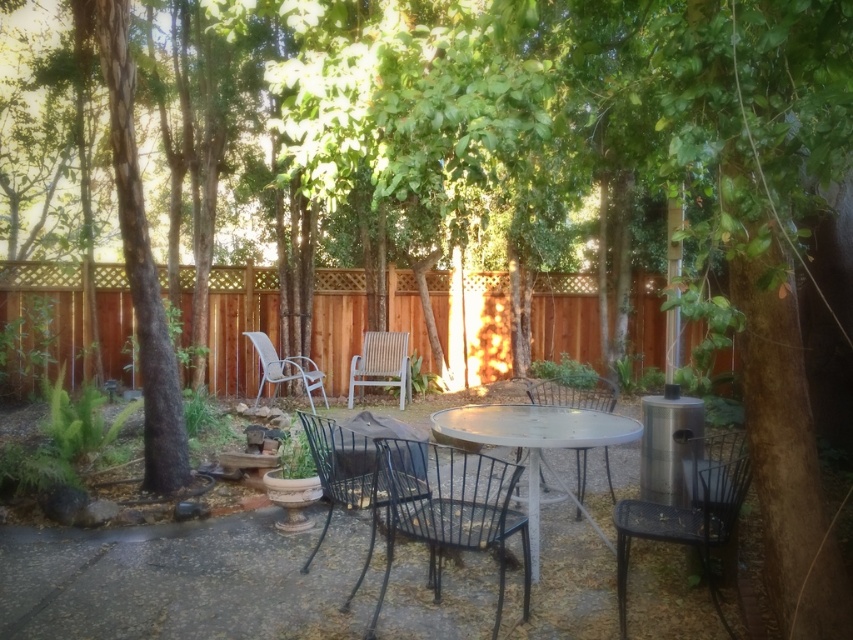
Between point (300, 413) and point (358, 371), which one is positioned in front?

Point (300, 413) is more forward.

Find the location of a particular element. black wrought iron chair at center is located at coordinates (345, 477).

Is black metal chair at lower right bigger than light brown woven chair at center?

No, black metal chair at lower right is not bigger than light brown woven chair at center.

Is black metal chair at lower right positioned before light brown woven chair at center?

Yes, black metal chair at lower right is closer to the viewer.

Who is more distant from viewer, (628, 548) or (374, 371)?

The point (374, 371) is more distant.

Where is `black metal chair at lower right`? The image size is (853, 640). black metal chair at lower right is located at coordinates (689, 513).

I want to click on white metal table at center, so click(x=537, y=444).

Does white metal table at center have a greater height compared to black wrought iron chair at center?

Yes.

Is point (595, 417) farther from camera compared to point (350, 460)?

No, it is not.

You are a GUI agent. You are given a task and a screenshot of the screen. Output one action in this format:
    pyautogui.click(x=<x>, y=<y>)
    Task: Click on the white metal table at center
    Image resolution: width=853 pixels, height=640 pixels.
    Given the screenshot: What is the action you would take?
    pyautogui.click(x=537, y=444)